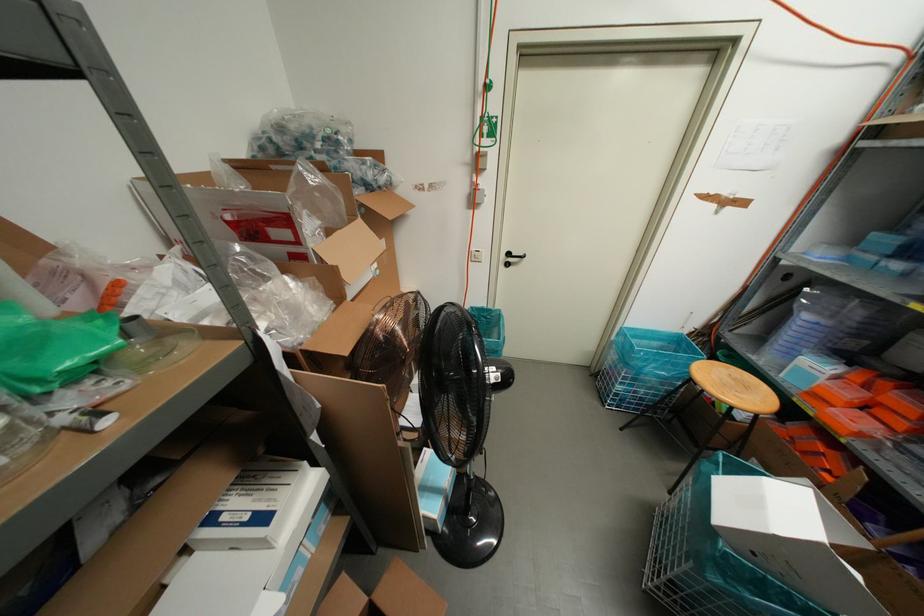
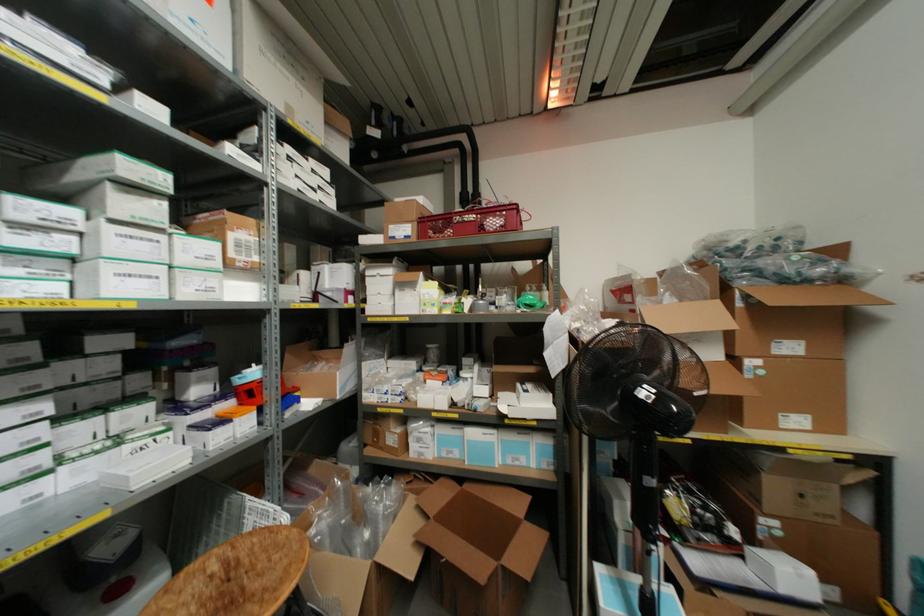
Question: The camera is either moving clockwise (left) or counter-clockwise (right) around the object. The first image is from the beginning of the video and the second image is from the end. Is the camera moving left or right when shooting the video?

Choices:
 (A) Left
 (B) Right

Answer: (B)